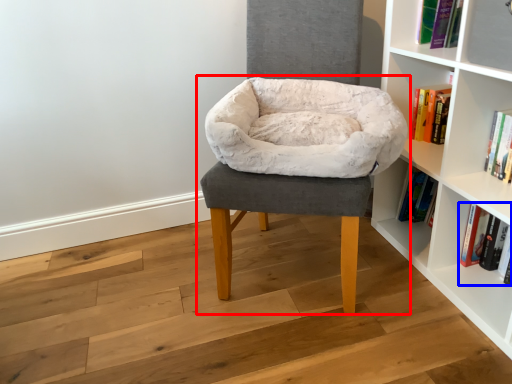
Question: Which object appears closest to the camera in this image, chair (highlighted by a red box) or book (highlighted by a blue box)?

Choices:
 (A) chair
 (B) book

Answer: (A)